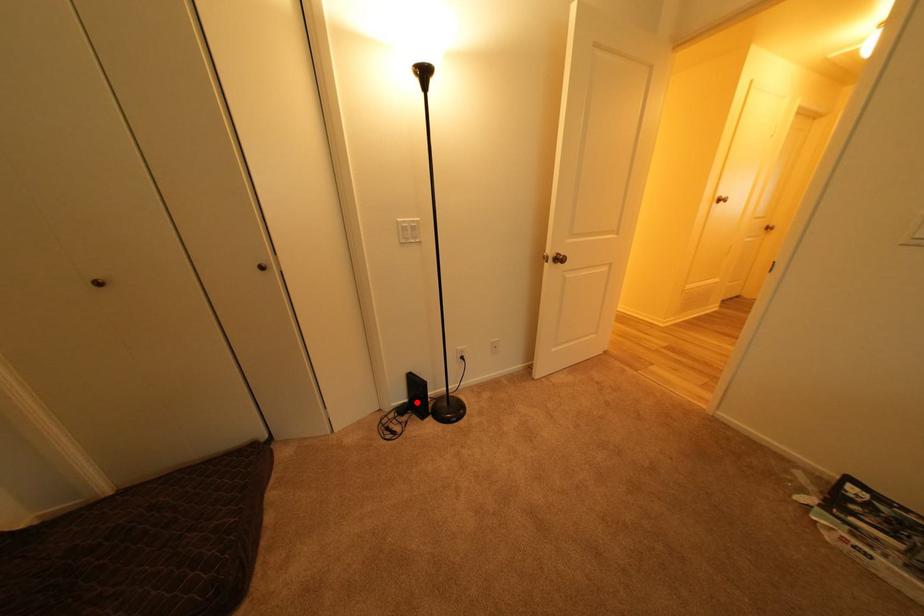
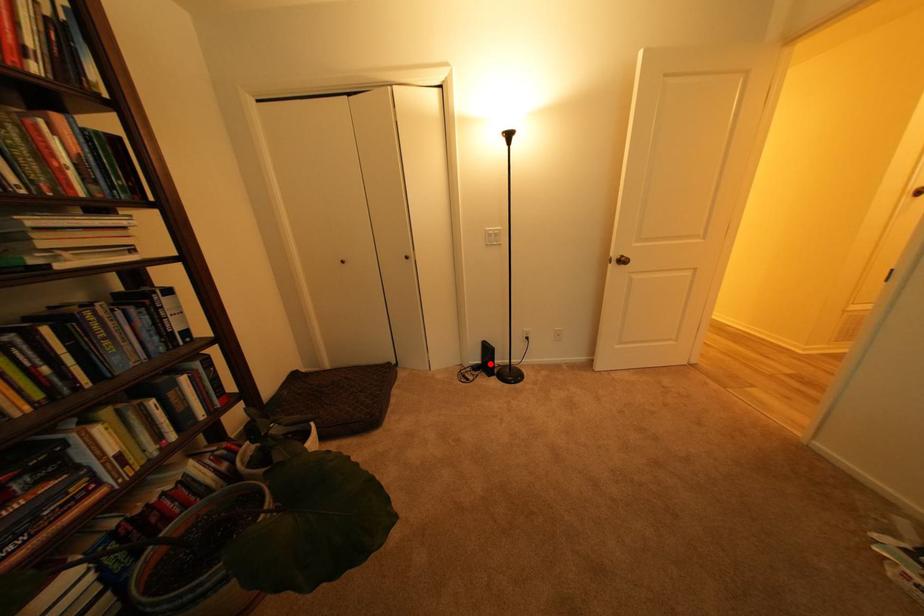
I am providing you with two images of the same scene from different viewpoints. A red point is marked on the first image and another point is marked on the second image. Is the red point in image1 aligned with the point shown in image2?

Yes